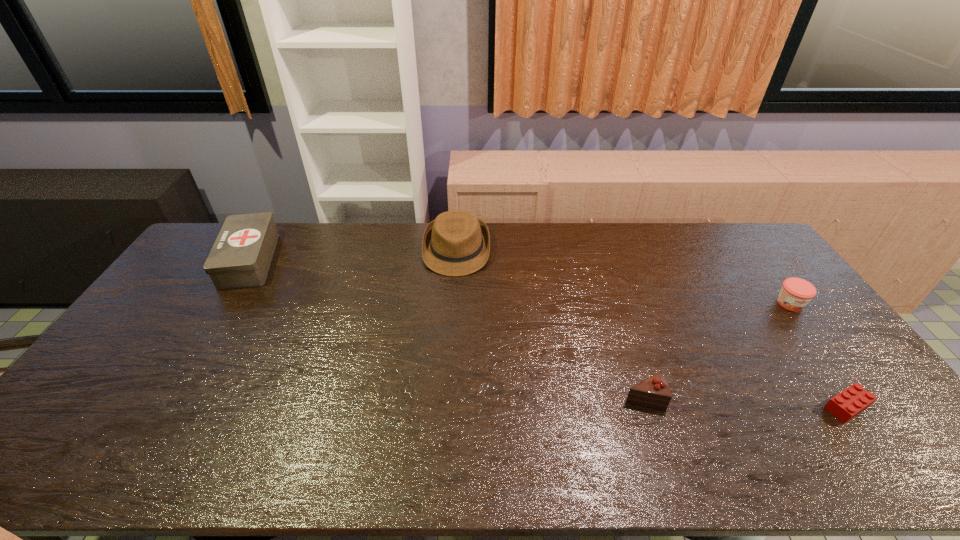
I want to click on fedora that is at the far edge, so click(456, 243).

Where is `the first-aid kit present at the far edge`? the first-aid kit present at the far edge is located at coordinates (240, 258).

At what (x,y) coordinates should I click in order to perform the action: click on object located at the left edge. Please return your answer as a coordinate pair (x, y). Looking at the image, I should click on (240, 258).

This screenshot has width=960, height=540. I want to click on jam present at the right edge, so click(795, 294).

Identify the location of Lego present at the right edge. (847, 404).

This screenshot has width=960, height=540. I want to click on object that is at the far left corner, so click(x=240, y=258).

Find the location of a particular element. Image resolution: width=960 pixels, height=540 pixels. vacant space at the far edge is located at coordinates (496, 244).

In order to click on vacant area at the left edge of the desktop in this screenshot , I will do `click(169, 327)`.

This screenshot has width=960, height=540. I want to click on vacant space at the right edge, so point(806,380).

You are a GUI agent. You are given a task and a screenshot of the screen. Output one action in this format:
    pyautogui.click(x=<x>, y=<y>)
    Task: Click on the free point at the far right corner
    Image resolution: width=960 pixels, height=540 pixels.
    Given the screenshot: What is the action you would take?
    pyautogui.click(x=746, y=233)